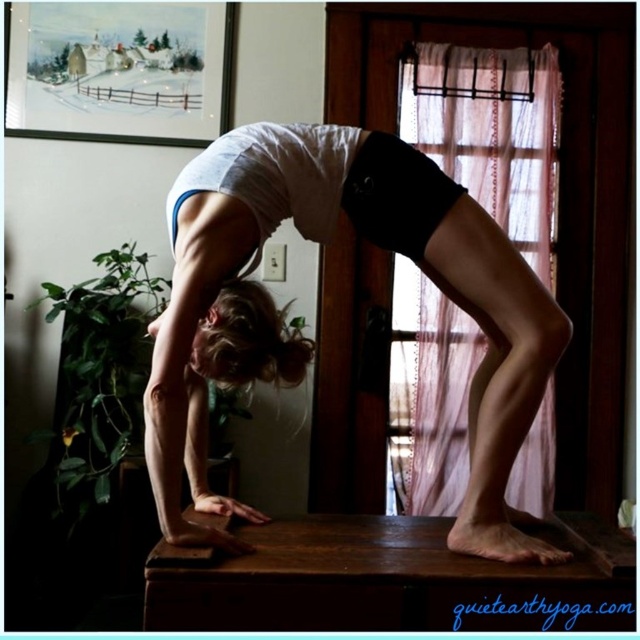
Question: Does white cotton shirt at center have a lesser width compared to sheer pink fabric at upper center?

Choices:
 (A) no
 (B) yes

Answer: (A)

Question: Does white cotton shirt at center have a lesser width compared to sheer pink fabric at upper center?

Choices:
 (A) no
 (B) yes

Answer: (A)

Question: Among these points, which one is nearest to the camera?

Choices:
 (A) (179, 419)
 (B) (538, 170)

Answer: (A)

Question: Which object appears farthest from the camera in this image?

Choices:
 (A) white cotton shirt at center
 (B) sheer pink fabric at upper center

Answer: (B)

Question: Is white cotton shirt at center bigger than sheer pink fabric at upper center?

Choices:
 (A) no
 (B) yes

Answer: (B)

Question: Which point is farther to the camera?

Choices:
 (A) white cotton shirt at center
 (B) sheer pink fabric at upper center

Answer: (B)